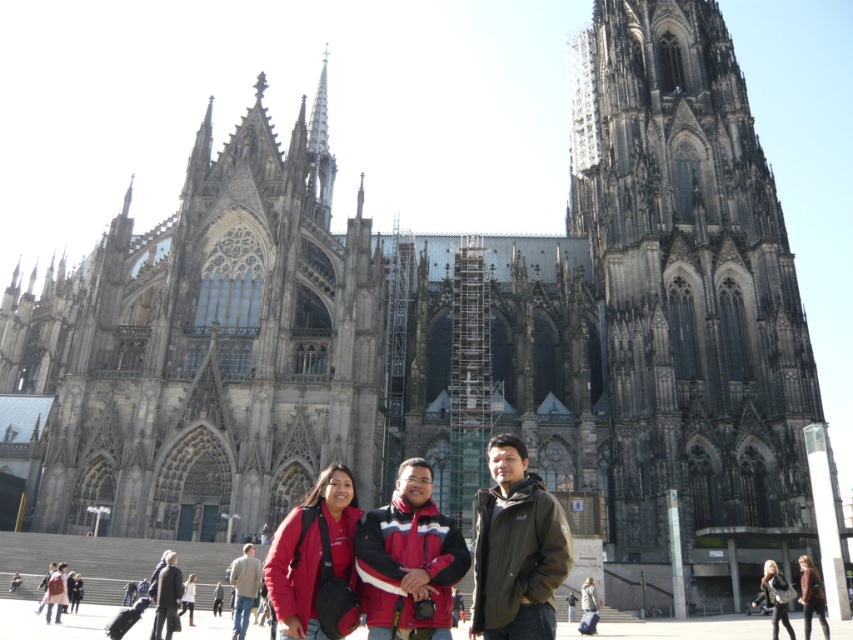
You are taking a photo of the Cologne Cathedral and want to ensure the matte red jacket at center is included in the frame. What coordinates should you focus on to capture it?

The matte red jacket at center is located at coordinates point (311, 552), so focusing there will include it in the photo.